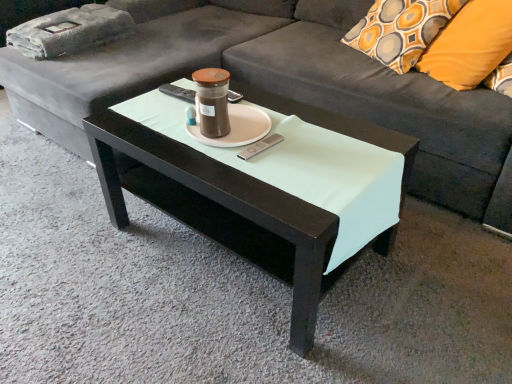
Where is `free space to the left of matte brown glass candle holder at center`? free space to the left of matte brown glass candle holder at center is located at coordinates (169, 113).